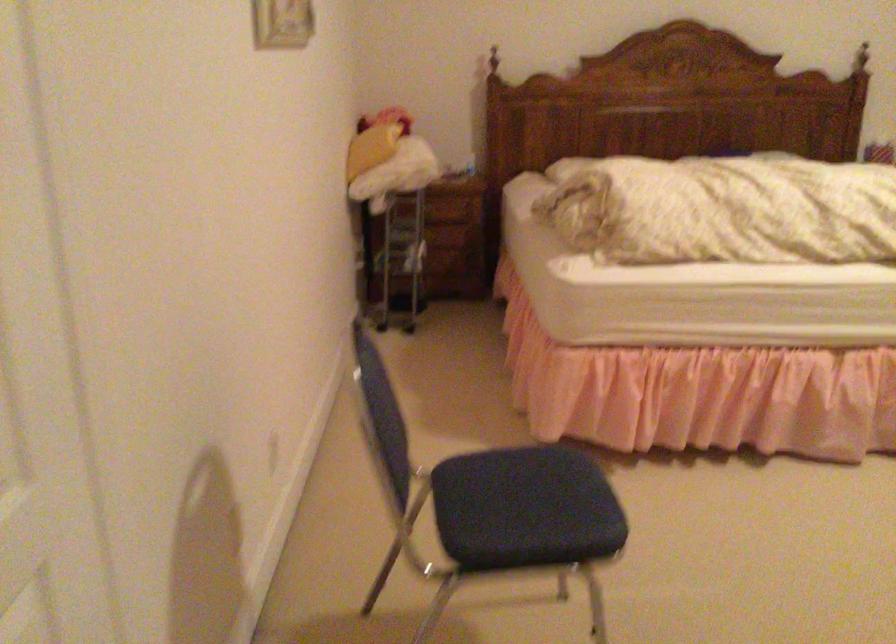
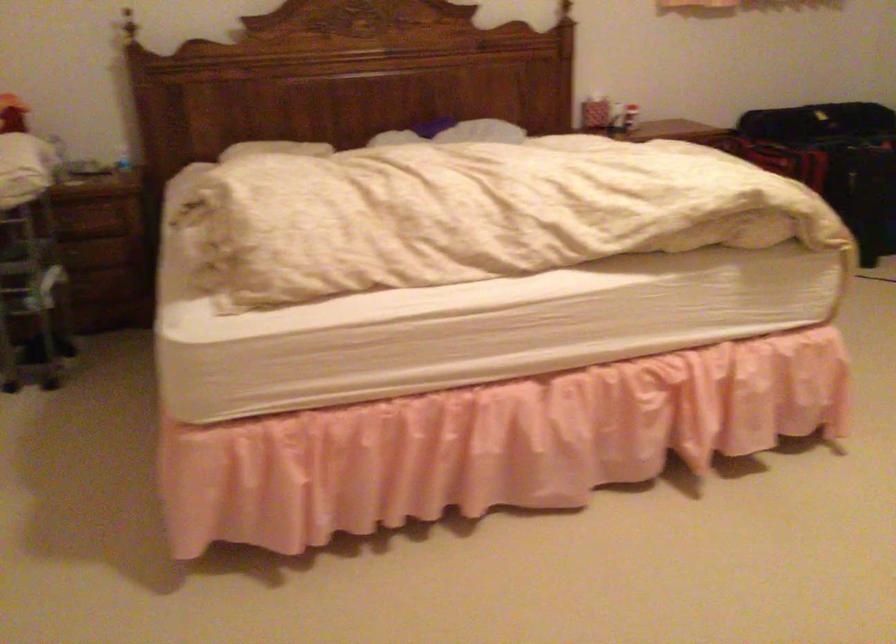
In a continuous first-person perspective shot, in which direction is the camera moving?

The movement direction of the cameraman is right, forward.